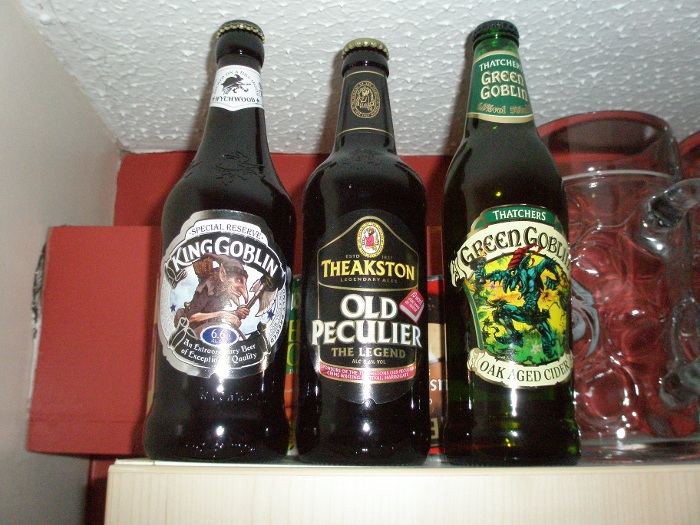
The width and height of the screenshot is (700, 525). In order to click on counter in this screenshot , I will do `click(348, 497)`.